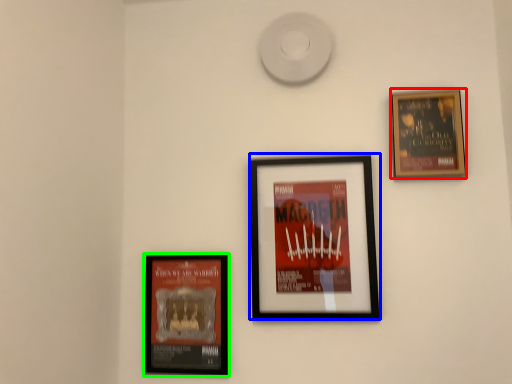
Question: Which object is positioned closest to picture frame (highlighted by a red box)? Select from picture frame (highlighted by a blue box) and picture frame (highlighted by a green box).

Choices:
 (A) picture frame
 (B) picture frame

Answer: (A)